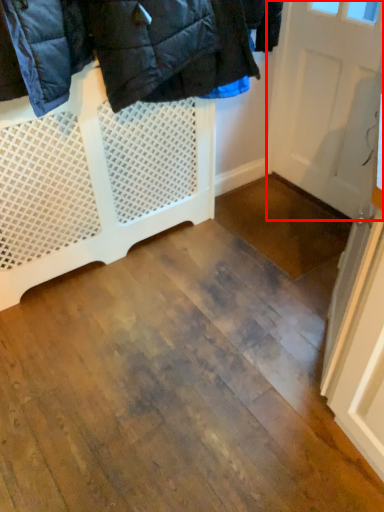
Question: Where is door (annotated by the red box) located in relation to furniture in the image?

Choices:
 (A) right
 (B) left

Answer: (A)